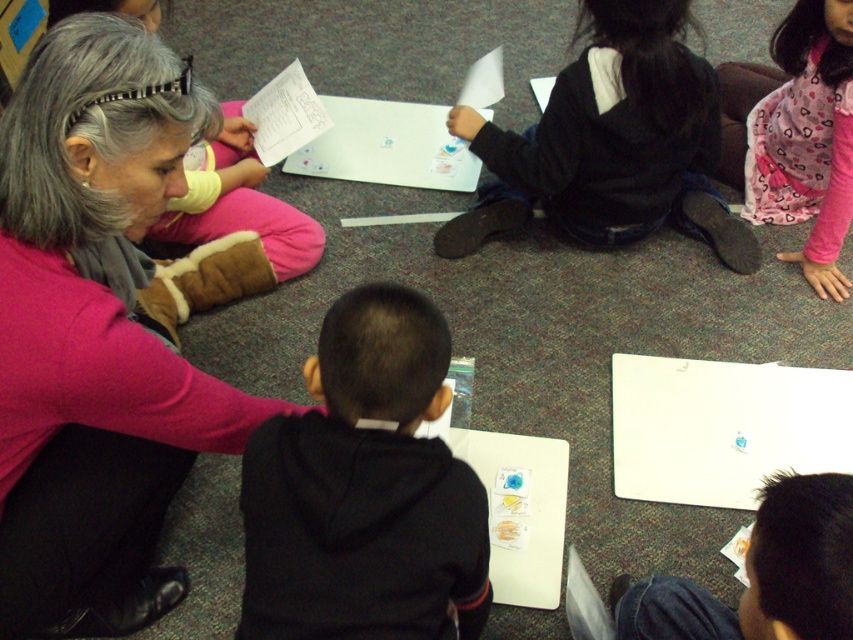
You are a photographer trying to capture a closeup of the two points in the image. Which point, point (393, 396) or point (648, 65), is closer to your camera lens?

Point (393, 396) is closer to the camera lens than point (648, 65).

You are a teacher in a classroom. You need to locate the black fleece hoodie at center for a group activity. Where exactly is it positioned in the room?

The black fleece hoodie at center is positioned at the coordinates point (x=364, y=490) in the room.